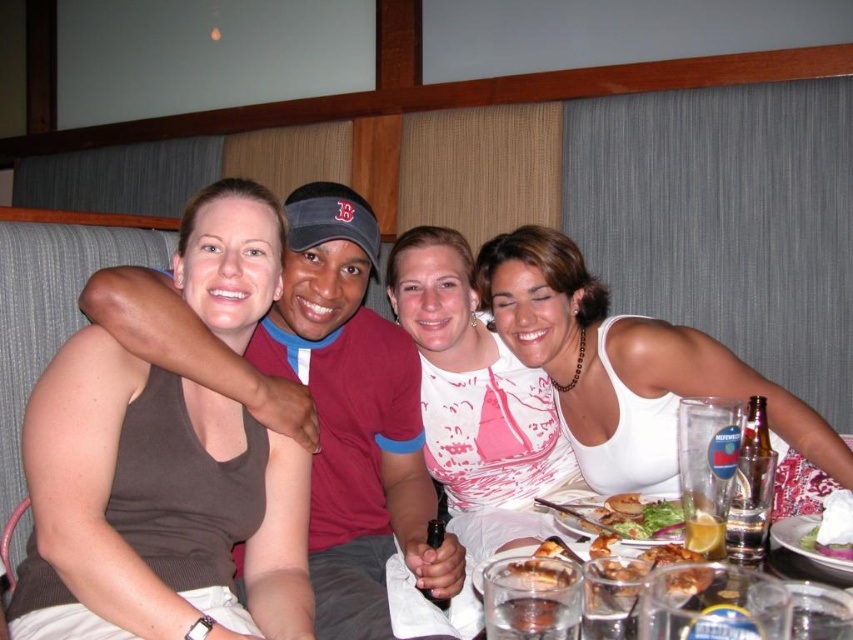
Is point (527, 369) more distant than point (839, 529)?

Yes, it is.

Measure the distance from pink fabric shirt at center to smooth white cream at lower right.

pink fabric shirt at center and smooth white cream at lower right are 29.02 inches apart from each other.

Is point (451, 259) positioned in front of point (844, 524)?

That is False.

Where is `pink fabric shirt at center`? The width and height of the screenshot is (853, 640). pink fabric shirt at center is located at coordinates (473, 384).

Looking at this image, is clear glass water at lower right positioned before golden crispy fries at center?

Yes.

Consider the image. Between clear glass water at lower right and golden crispy fries at center, which one has more height?

With more height is clear glass water at lower right.

Image resolution: width=853 pixels, height=640 pixels. In order to click on clear glass water at lower right in this screenshot , I will do `click(804, 566)`.

Can you confirm if clear glass water at lower right is shorter than smooth white cream at lower right?

Correct, clear glass water at lower right is not as tall as smooth white cream at lower right.

Who is more distant from viewer, (x=767, y=560) or (x=833, y=497)?

The point (x=833, y=497) is more distant.

Is point (850, 628) positioned before point (846, 541)?

Yes, it is in front of point (846, 541).

The height and width of the screenshot is (640, 853). In order to click on clear glass water at lower right in this screenshot , I will do `click(804, 566)`.